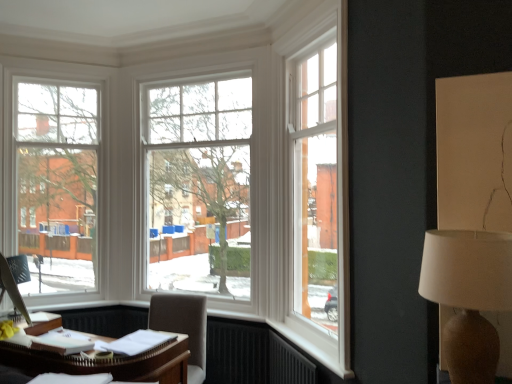
Question: From the image's perspective, is light brown fabric chair at lower center beneath white wooden window at center, the first window from the right?

Choices:
 (A) no
 (B) yes

Answer: (B)

Question: Is light brown fabric chair at lower center turned away from white wooden window at center, the first window from the right?

Choices:
 (A) no
 (B) yes

Answer: (A)

Question: From a real-world perspective, does light brown fabric chair at lower center sit lower than white wooden window at center, which is the 2th window from left to right?

Choices:
 (A) yes
 (B) no

Answer: (A)

Question: Can you confirm if light brown fabric chair at lower center is shorter than white wooden window at center, which is the 2th window from left to right?

Choices:
 (A) yes
 (B) no

Answer: (A)

Question: Is white wooden window at center, the first window from the right, completely or partially inside light brown fabric chair at lower center?

Choices:
 (A) no
 (B) yes

Answer: (A)

Question: From a real-world perspective, relative to white wooden window at center, the first window from the right, is clear glass window at left, which appears as the 1th window when viewed from the left, vertically above or below?

Choices:
 (A) below
 (B) above

Answer: (B)

Question: Choose the correct answer: Is clear glass window at left, which appears as the 1th window when viewed from the left, inside white wooden window at center, which is the 2th window from left to right, or outside it?

Choices:
 (A) inside
 (B) outside

Answer: (B)

Question: Visually, is clear glass window at left, which appears as the 1th window when viewed from the left, positioned to the left or to the right of white wooden window at center, which is the 2th window from left to right?

Choices:
 (A) left
 (B) right

Answer: (A)

Question: From the image's perspective, is clear glass window at left, which is the 2th window from right to left, located above or below white wooden window at center, the first window from the right?

Choices:
 (A) below
 (B) above

Answer: (B)

Question: In the image, is white wooden window at center, the first window from the right, positioned in front of or behind light brown fabric chair at lower center?

Choices:
 (A) behind
 (B) front

Answer: (A)

Question: Considering the relative positions of white wooden window at center, which is the 2th window from left to right, and light brown fabric chair at lower center in the image provided, is white wooden window at center, which is the 2th window from left to right, to the left or to the right of light brown fabric chair at lower center?

Choices:
 (A) left
 (B) right

Answer: (B)

Question: In terms of size, does white wooden window at center, which is the 2th window from left to right, appear bigger or smaller than light brown fabric chair at lower center?

Choices:
 (A) small
 (B) big

Answer: (B)

Question: Is point (159, 148) positioned closer to the camera than point (159, 309)?

Choices:
 (A) closer
 (B) farther

Answer: (B)

Question: Is light brown fabric chair at lower center bigger or smaller than white wooden window at center, the first window from the right?

Choices:
 (A) small
 (B) big

Answer: (A)

Question: From the image's perspective, is light brown fabric chair at lower center positioned above or below white wooden window at center, which is the 2th window from left to right?

Choices:
 (A) above
 (B) below

Answer: (B)